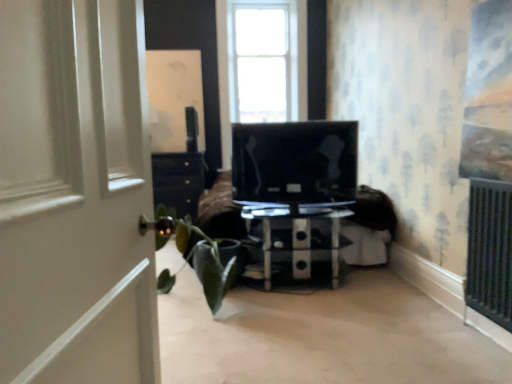
Question: From a real-world perspective, is green matte houseplant at left above or below black glossy tv at center?

Choices:
 (A) below
 (B) above

Answer: (A)

Question: Relative to black glossy tv at center, is green matte houseplant at left in front or behind?

Choices:
 (A) front
 (B) behind

Answer: (A)

Question: Considering the real-world distances, which object is closest to the white wooden door at left?

Choices:
 (A) transparent glass coffee table at center
 (B) green matte houseplant at left
 (C) black glossy tv at center

Answer: (B)

Question: Which of these objects is positioned farthest from the transparent glass coffee table at center?

Choices:
 (A) green matte houseplant at left
 (B) black glossy tv at center
 (C) white wooden door at left

Answer: (C)